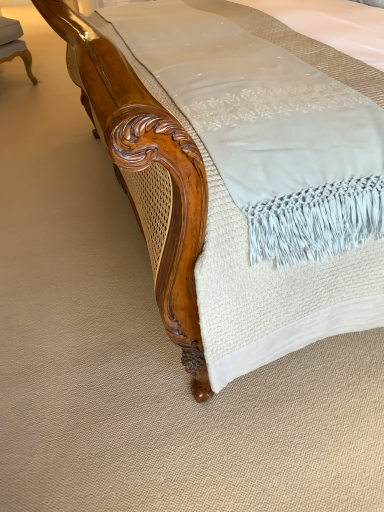
The image size is (384, 512). I want to click on matte white stool at left, so click(x=14, y=45).

What is the approximate height of matte white stool at left?

49.22 centimeters.

Describe the element at coordinates (14, 45) in the screenshot. I see `matte white stool at left` at that location.

What are the coordinates of `matte white stool at left` in the screenshot? It's located at (14, 45).